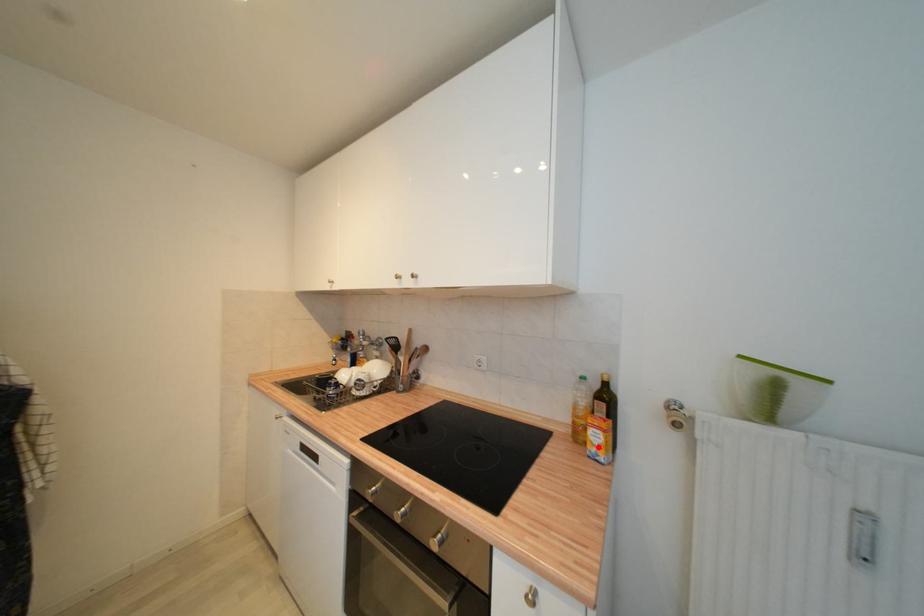
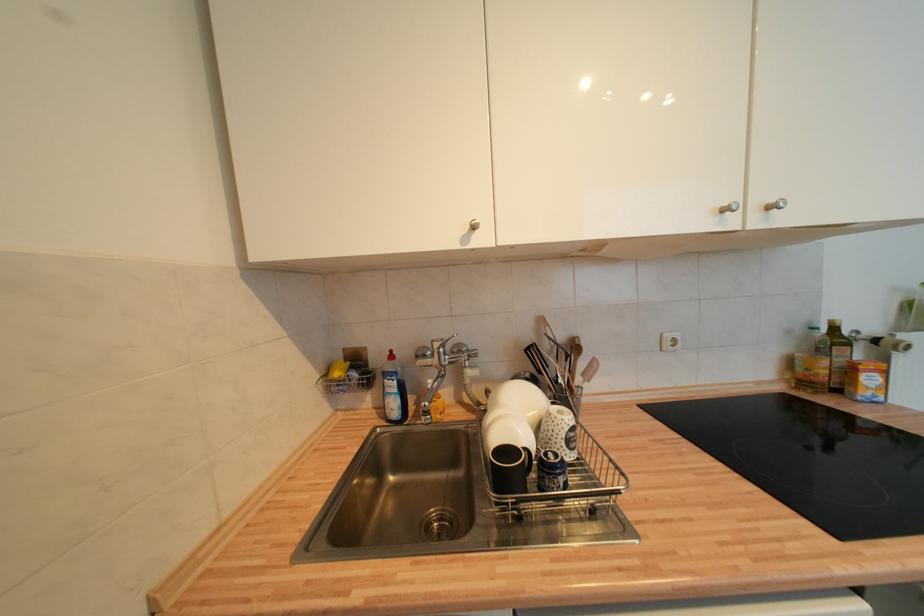
Question: A red point is marked in image1. In image2, is the corresponding 3D point closer to the camera or farther? Reply with the corresponding letter.

Choices:
 (A) The corresponding 3D point is closer.
 (B) The corresponding 3D point is farther.

Answer: (A)